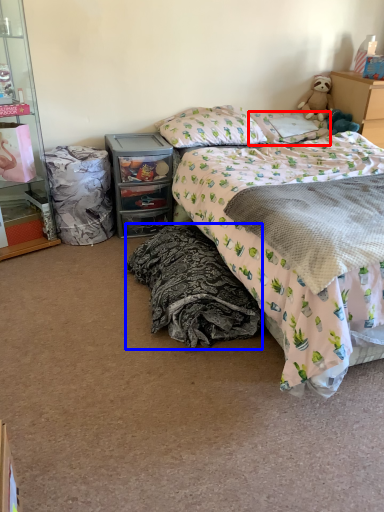
Question: Which object appears farthest to the camera in this image, pillow (highlighted by a red box) or blanket (highlighted by a blue box)?

Choices:
 (A) pillow
 (B) blanket

Answer: (A)